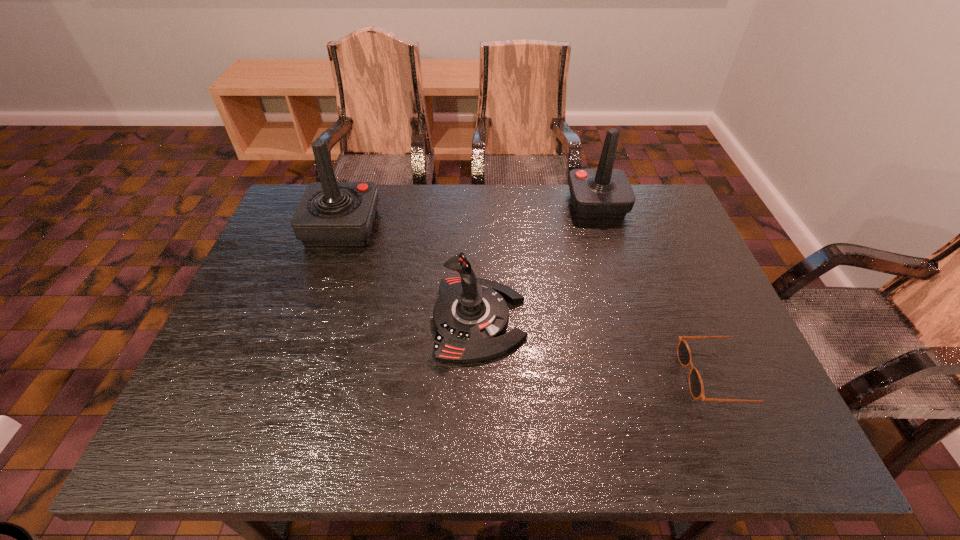
What are the coordinates of `vacant space at the near left corner` in the screenshot? It's located at (194, 448).

Locate an element on the screen. free spot at the far right corner of the desktop is located at coordinates (632, 225).

Locate an element on the screen. free spot between the leftmost joystick and the rightmost joystick is located at coordinates (469, 215).

The height and width of the screenshot is (540, 960). Find the location of `vacant space that's between the rightmost joystick and the nearest joystick`. vacant space that's between the rightmost joystick and the nearest joystick is located at coordinates (538, 261).

Where is `unoccupied position between the leftmost object and the sunglasses`? Image resolution: width=960 pixels, height=540 pixels. unoccupied position between the leftmost object and the sunglasses is located at coordinates (532, 301).

This screenshot has width=960, height=540. In order to click on unoccupied position between the leftmost joystick and the rightmost joystick in this screenshot , I will do `click(469, 215)`.

Locate an element on the screen. Image resolution: width=960 pixels, height=540 pixels. free space between the leftmost joystick and the sunglasses is located at coordinates (532, 301).

What are the coordinates of `vacant space that's between the shortest joystick and the shortest object` in the screenshot? It's located at (599, 348).

Find the location of a particular element. This screenshot has width=960, height=540. vacant space that's between the rightmost joystick and the shortest object is located at coordinates (659, 290).

Identify the location of free point between the rightmost joystick and the leftmost joystick. This screenshot has width=960, height=540. (469, 215).